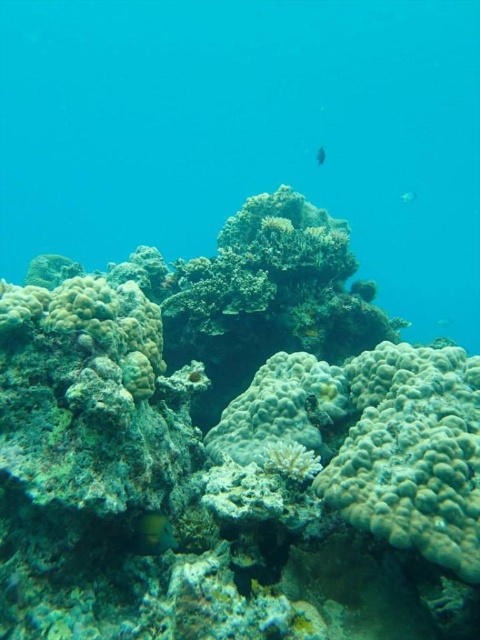
You are a diver exploring the underwater scene. You notice the white coral reef at center and the shiny yellow fish at lower left. Which object is positioned higher in the water column?

The white coral reef at center is positioned higher in the water column than the shiny yellow fish at lower left.

You are a marine biologist studying the coral reef. You observe the shiny yellow fish at lower left in the image. What are the coordinates of its position in the image?

The coordinates of the shiny yellow fish at lower left are at point (152, 532).

You are a marine biologist observing the underwater scene. You notice the shiny yellow fish at lower left and the translucent blue fish at upper center. Based on their positions, which fish is closer to the ocean floor?

The shiny yellow fish at lower left is closer to the ocean floor since it is positioned below the translucent blue fish at upper center.